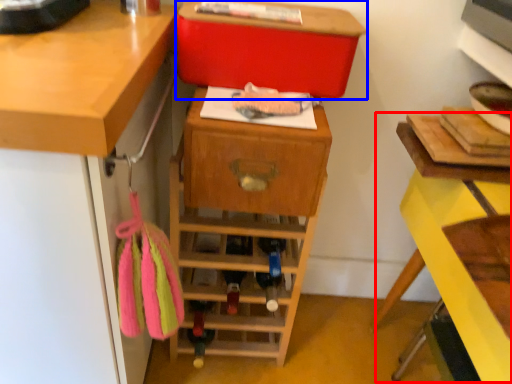
Question: Which point is further to the camera, computer desk (highlighted by a red box) or storage box (highlighted by a blue box)?

Choices:
 (A) computer desk
 (B) storage box

Answer: (B)